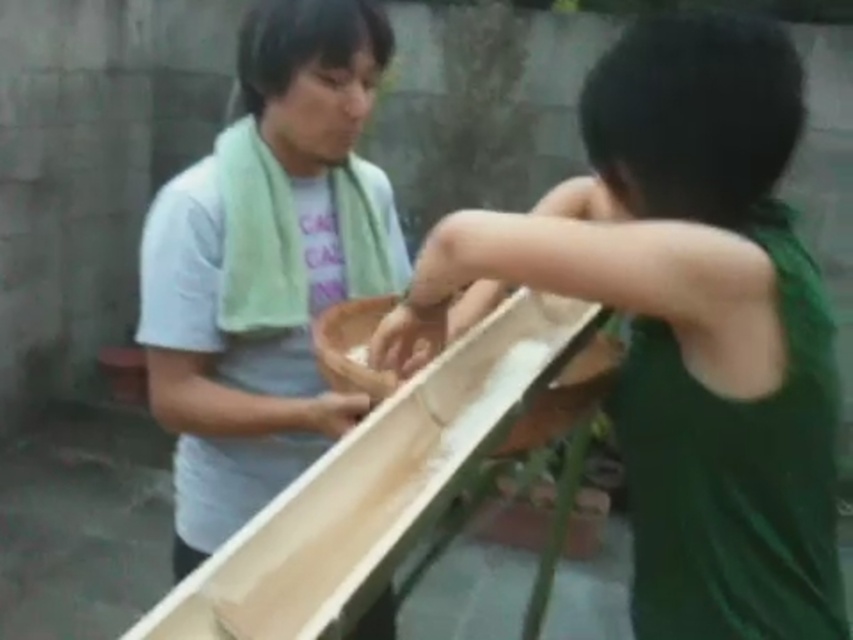
You are planning to place a 1.2 meter wide decorative panel between the green fabric shirt at right and the smooth wooden trough at center. Based on their widths, will the panel fit without overlapping either object?

The green fabric shirt at right is wider than the smooth wooden trough at center. However, since the panel is 1.2 meters wide, we need to know the exact widths of both objects to determine if there is enough space. Unfortunately, the provided information only states which is wider, not the specific measurements. Therefore, it is impossible to confirm if the panel will fit without additional data.

You are a delivery person who needs to place a small package between the green fabric shirt at right and the smooth wooden trough at center. The package is 9 inches long. Can it fit between them without overlapping either object?

The distance between the green fabric shirt at right and the smooth wooden trough at center is 8.95 inches. Since the package is 9 inches long, it cannot fit between them without overlapping one of the objects.

You are standing in the garden and see the green fabric shirt at right and the smooth wooden trough at center. Which object is higher in position?

The green fabric shirt at right is located above the smooth wooden trough at center, so the green fabric shirt at right is higher.